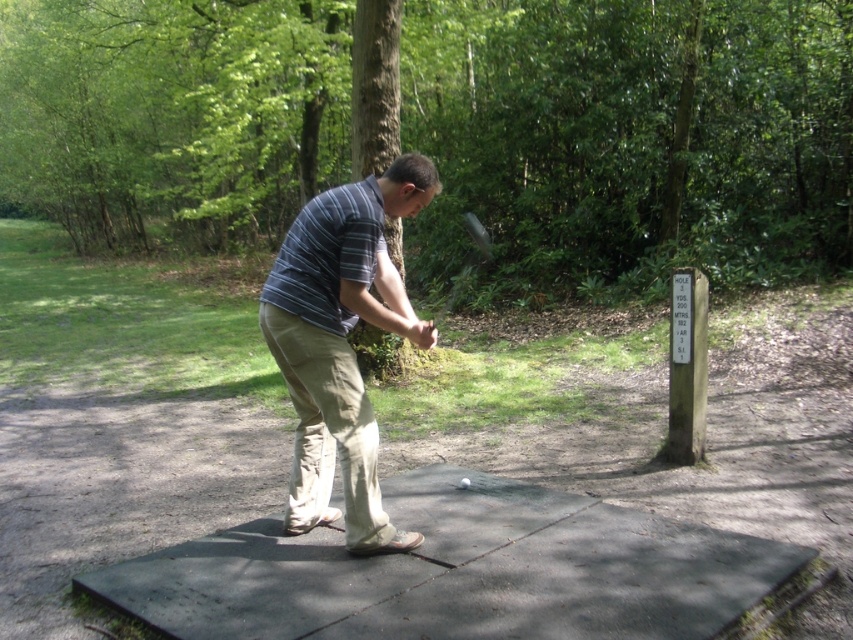
From the picture: You are a photographer standing behind the golfer. You need to capture a photo where both the striped cotton shirt at center and the shiny black golf club at center are clearly visible. Based on their heights, which object will appear taller in the photo?

The striped cotton shirt at center will appear taller in the photo since it has a greater height compared to the shiny black golf club at center.

You are a photographer taking a picture of the striped cotton shirt at center and the shiny black golf club at center. Which object should you adjust your camera focus to first if you want to capture both clearly in the same frame?

You should focus on the shiny black golf club at center first because the striped cotton shirt at center is to the left of it, meaning the shirt is closer to the camera. Adjusting focus starting from the closer object ensures both are in focus when using depth of field.